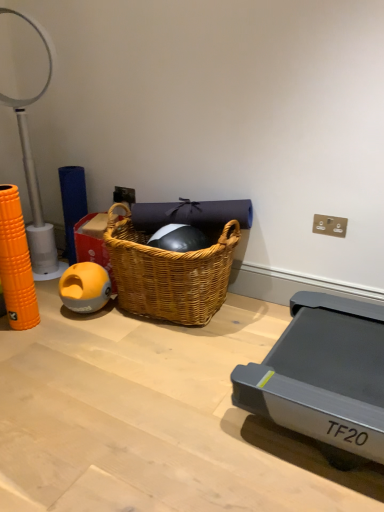
This screenshot has width=384, height=512. What do you see at coordinates (169, 273) in the screenshot? I see `woven wood picnic basket at center` at bounding box center [169, 273].

What do you see at coordinates (35, 178) in the screenshot? I see `white plastic table lamp at left` at bounding box center [35, 178].

This screenshot has height=512, width=384. I want to click on yellow rubber ball at left, so click(x=85, y=287).

Relative to white plastic table lamp at left, is yellow rubber ball at left in front or behind?

Clearly, yellow rubber ball at left is behind white plastic table lamp at left.

Is yellow rubber ball at left looking in the opposite direction of white plastic table lamp at left?

No, white plastic table lamp at left is not at the back of yellow rubber ball at left.

Where is `ball beneath the white plastic table lamp at left (from a real-world perspective)`? This screenshot has width=384, height=512. ball beneath the white plastic table lamp at left (from a real-world perspective) is located at coordinates (85, 287).

Are wooden floor at lower left and yellow rubber ball at left far apart?

wooden floor at lower left is actually quite close to yellow rubber ball at left.

From the image's perspective, between wooden floor at lower left and yellow rubber ball at left, who is located below?

From the image's view, wooden floor at lower left is below.

Which object is thinner, wooden floor at lower left or yellow rubber ball at left?

yellow rubber ball at left.

Looking at this image, is woven wood picnic basket at center turned away from wooden floor at lower left?

No.

Which is behind, point (148, 254) or point (209, 355)?

Point (148, 254)

From their relative heights in the image, would you say woven wood picnic basket at center is taller or shorter than wooden floor at lower left?

Considering their sizes, woven wood picnic basket at center has more height than wooden floor at lower left.

Image resolution: width=384 pixels, height=512 pixels. What are the coordinates of `picnic basket above the wooden floor at lower left (from a real-world perspective)` in the screenshot? It's located at (169, 273).

From a real-world perspective, which is physically below, yellow rubber ball at left or wooden floor at lower left?

Result: From a 3D spatial view, wooden floor at lower left is below.

How much distance is there between yellow rubber ball at left and wooden floor at lower left?

yellow rubber ball at left and wooden floor at lower left are 20.44 inches apart.

Is yellow rubber ball at left aimed at wooden floor at lower left?

No, yellow rubber ball at left is not turned towards wooden floor at lower left.

Does yellow rubber ball at left touch wooden floor at lower left?

No.

How much distance is there between yellow rubber ball at left and woven wood picnic basket at center?

yellow rubber ball at left and woven wood picnic basket at center are 11.78 inches apart from each other.

Which is in front, yellow rubber ball at left or woven wood picnic basket at center?

Positioned in front is woven wood picnic basket at center.

From the image's perspective, does yellow rubber ball at left appear higher than woven wood picnic basket at center?

No, from the image's perspective, yellow rubber ball at left is not on top of woven wood picnic basket at center.

Which is behind, point (50, 233) or point (206, 304)?

The point (50, 233) is behind.

Is white plastic table lamp at left wider than woven wood picnic basket at center?

Incorrect, the width of white plastic table lamp at left does not surpass that of woven wood picnic basket at center.

Is white plastic table lamp at left located outside woven wood picnic basket at center?

That's correct, white plastic table lamp at left is outside of woven wood picnic basket at center.

From the image's perspective, which one is positioned lower, woven wood picnic basket at center or yellow rubber ball at left?

yellow rubber ball at left is shown below in the image.

What are the coordinates of `picnic basket that appears in front of the yellow rubber ball at left` in the screenshot? It's located at (169, 273).

In the image, is woven wood picnic basket at center on the left side or the right side of yellow rubber ball at left?

From the image, it's evident that woven wood picnic basket at center is to the right of yellow rubber ball at left.

Is woven wood picnic basket at center outside of yellow rubber ball at left?

Absolutely, woven wood picnic basket at center is external to yellow rubber ball at left.

This screenshot has height=512, width=384. I want to click on table lamp on the left of yellow rubber ball at left, so click(35, 178).

Image resolution: width=384 pixels, height=512 pixels. I want to click on ball above the wooden floor at lower left (from the image's perspective), so click(85, 287).

Considering their positions, is white plastic table lamp at left positioned closer to wooden floor at lower left than woven wood picnic basket at center?

woven wood picnic basket at center.

From the image, which object appears to be farther from white plastic table lamp at left, yellow rubber ball at left or wooden floor at lower left?

wooden floor at lower left lies further to white plastic table lamp at left than the other object.

From the image, which object appears to be nearer to woven wood picnic basket at center, white plastic table lamp at left or wooden floor at lower left?

The object closer to woven wood picnic basket at center is wooden floor at lower left.

Estimate the real-world distances between objects in this image. Which object is closer to yellow rubber ball at left, wooden floor at lower left or white plastic table lamp at left?

Based on the image, wooden floor at lower left appears to be nearer to yellow rubber ball at left.

Looking at the image, which one is located further to woven wood picnic basket at center, wooden floor at lower left or yellow rubber ball at left?

wooden floor at lower left is positioned further to the anchor woven wood picnic basket at center.

When comparing their distances from woven wood picnic basket at center, does wooden floor at lower left or white plastic table lamp at left seem closer?

Among the two, wooden floor at lower left is located nearer to woven wood picnic basket at center.

Estimate the real-world distances between objects in this image. Which object is closer to white plastic table lamp at left, wooden floor at lower left or woven wood picnic basket at center?

The object closer to white plastic table lamp at left is woven wood picnic basket at center.

Estimate the real-world distances between objects in this image. Which object is further from yellow rubber ball at left, wooden floor at lower left or woven wood picnic basket at center?

wooden floor at lower left is positioned further to the anchor yellow rubber ball at left.

This screenshot has height=512, width=384. I want to click on table lamp between wooden floor at lower left and yellow rubber ball at left along the z-axis, so click(35, 178).

This screenshot has width=384, height=512. In order to click on ball between white plastic table lamp at left and woven wood picnic basket at center in this screenshot , I will do `click(85, 287)`.

Identify the location of picnic basket between wooden floor at lower left and white plastic table lamp at left along the z-axis. (169, 273).

Find the location of a particular element. Image resolution: width=384 pixels, height=512 pixels. picnic basket positioned between wooden floor at lower left and yellow rubber ball at left from near to far is located at coordinates (169, 273).